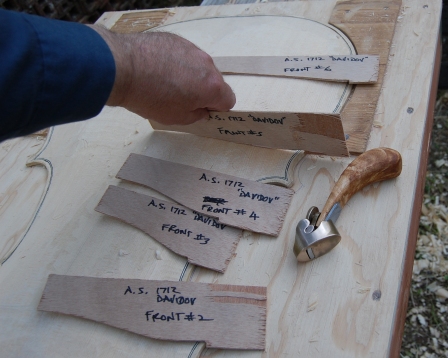
I want to click on floor, so click(426, 323).